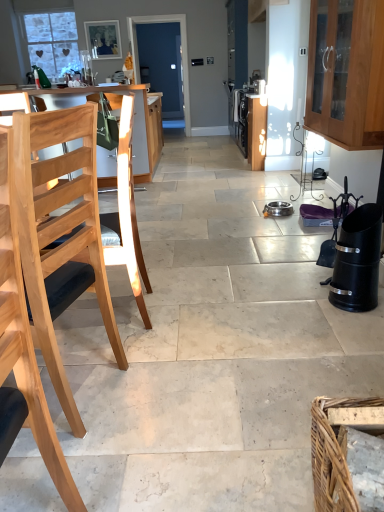
Question: Is white frosted glass window at upper left behind brown woven basket at lower right?

Choices:
 (A) yes
 (B) no

Answer: (A)

Question: Is white frosted glass window at upper left directly adjacent to brown woven basket at lower right?

Choices:
 (A) yes
 (B) no

Answer: (B)

Question: Can you confirm if white frosted glass window at upper left is positioned to the right of brown woven basket at lower right?

Choices:
 (A) yes
 (B) no

Answer: (B)

Question: Can you confirm if white frosted glass window at upper left is positioned to the left of brown woven basket at lower right?

Choices:
 (A) yes
 (B) no

Answer: (A)

Question: Can you confirm if white frosted glass window at upper left is taller than brown woven basket at lower right?

Choices:
 (A) no
 (B) yes

Answer: (B)

Question: Does point (41, 60) appear closer or farther from the camera than point (322, 482)?

Choices:
 (A) closer
 (B) farther

Answer: (B)

Question: From a real-world perspective, is white frosted glass window at upper left physically located above or below brown woven basket at lower right?

Choices:
 (A) below
 (B) above

Answer: (B)

Question: Do you think white frosted glass window at upper left is within brown woven basket at lower right, or outside of it?

Choices:
 (A) inside
 (B) outside

Answer: (B)

Question: Based on their sizes in the image, would you say white frosted glass window at upper left is bigger or smaller than brown woven basket at lower right?

Choices:
 (A) small
 (B) big

Answer: (B)

Question: Looking at their shapes, would you say wooden cabinet at upper right, the 2th cabinetry when ordered from back to front, is wider or thinner than natural wood chair at left?

Choices:
 (A) wide
 (B) thin

Answer: (B)

Question: From the image's perspective, relative to natural wood chair at left, is wooden cabinet at upper right, which appears as the first cabinetry when viewed from the front, above or below?

Choices:
 (A) above
 (B) below

Answer: (A)

Question: From their relative heights in the image, would you say wooden cabinet at upper right, the 2th cabinetry when ordered from back to front, is taller or shorter than natural wood chair at left?

Choices:
 (A) short
 (B) tall

Answer: (A)

Question: In the image, is wooden cabinet at upper right, positioned as the 1th cabinetry in right-to-left order, positioned in front of or behind natural wood chair at left?

Choices:
 (A) behind
 (B) front

Answer: (A)

Question: Would you say wooden cabinet at upper right, positioned as the 1th cabinetry in right-to-left order, is inside or outside wooden chair at left, the 1th cabinetry in the left-to-right sequence?

Choices:
 (A) inside
 (B) outside

Answer: (B)

Question: Considering the positions of wooden cabinet at upper right, acting as the second cabinetry starting from the left, and wooden chair at left, the 1th cabinetry in the left-to-right sequence, in the image, is wooden cabinet at upper right, acting as the second cabinetry starting from the left, taller or shorter than wooden chair at left, the 1th cabinetry in the left-to-right sequence,?

Choices:
 (A) tall
 (B) short

Answer: (B)